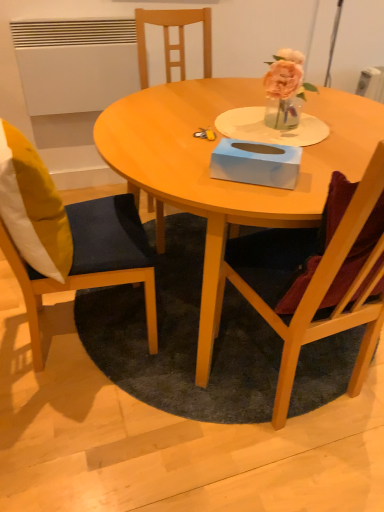
Identify the location of free spot above wooden table at center (from a real-world perspective). (252, 121).